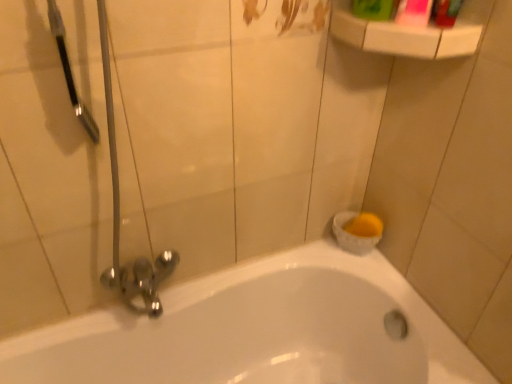
Question: Is green plastic mouthwash at upper right, arranged as the second mouthwash when viewed from the right, located within white glossy bathtub at lower center?

Choices:
 (A) yes
 (B) no

Answer: (B)

Question: Are white glossy bathtub at lower center and green plastic mouthwash at upper right, which is counted as the first mouthwash, starting from the left, far apart?

Choices:
 (A) yes
 (B) no

Answer: (B)

Question: Can you confirm if white glossy bathtub at lower center is thinner than green plastic mouthwash at upper right, which is counted as the first mouthwash, starting from the left?

Choices:
 (A) no
 (B) yes

Answer: (A)

Question: Is white glossy bathtub at lower center aimed at green plastic mouthwash at upper right, arranged as the second mouthwash when viewed from the right?

Choices:
 (A) no
 (B) yes

Answer: (A)

Question: Can you confirm if white glossy bathtub at lower center is positioned to the left of green plastic mouthwash at upper right, arranged as the second mouthwash when viewed from the right?

Choices:
 (A) yes
 (B) no

Answer: (A)

Question: Considering the positions of green plastic bottle at upper right and white glossy bathtub at lower center in the image, is green plastic bottle at upper right taller or shorter than white glossy bathtub at lower center?

Choices:
 (A) tall
 (B) short

Answer: (B)

Question: Considering the positions of green plastic bottle at upper right and white glossy bathtub at lower center in the image, is green plastic bottle at upper right bigger or smaller than white glossy bathtub at lower center?

Choices:
 (A) big
 (B) small

Answer: (B)

Question: In terms of width, does green plastic bottle at upper right look wider or thinner when compared to white glossy bathtub at lower center?

Choices:
 (A) thin
 (B) wide

Answer: (A)

Question: Based on their positions, is green plastic bottle at upper right located to the left or right of white glossy bathtub at lower center?

Choices:
 (A) left
 (B) right

Answer: (B)

Question: Is white glossy bathtub at lower center inside or outside of pink glossy mouthwash at upper right, the first mouthwash viewed from the right?

Choices:
 (A) outside
 (B) inside

Answer: (A)

Question: Is white glossy bathtub at lower center in front of or behind pink glossy mouthwash at upper right, marked as the second mouthwash in a left-to-right arrangement, in the image?

Choices:
 (A) behind
 (B) front

Answer: (B)

Question: In terms of height, does white glossy bathtub at lower center look taller or shorter compared to pink glossy mouthwash at upper right, marked as the second mouthwash in a left-to-right arrangement?

Choices:
 (A) short
 (B) tall

Answer: (B)

Question: Is point (139, 352) positioned closer to the camera than point (412, 6)?

Choices:
 (A) farther
 (B) closer

Answer: (A)

Question: Considering the positions of green plastic mouthwash at upper right, arranged as the second mouthwash when viewed from the right, and green plastic bottle at upper right in the image, is green plastic mouthwash at upper right, arranged as the second mouthwash when viewed from the right, wider or thinner than green plastic bottle at upper right?

Choices:
 (A) thin
 (B) wide

Answer: (B)

Question: In terms of height, does green plastic mouthwash at upper right, arranged as the second mouthwash when viewed from the right, look taller or shorter compared to green plastic bottle at upper right?

Choices:
 (A) tall
 (B) short

Answer: (A)